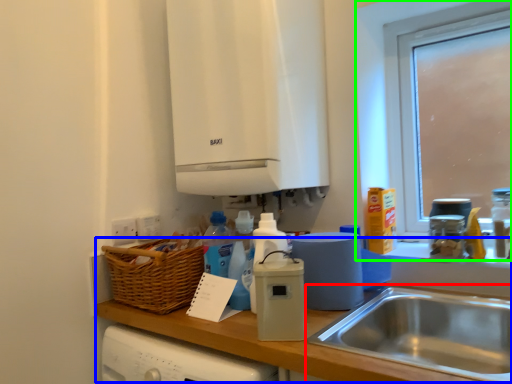
Question: Which is nearer to the sink (highlighted by a red box)? counter top (highlighted by a blue box) or window (highlighted by a green box).

Choices:
 (A) counter top
 (B) window

Answer: (A)